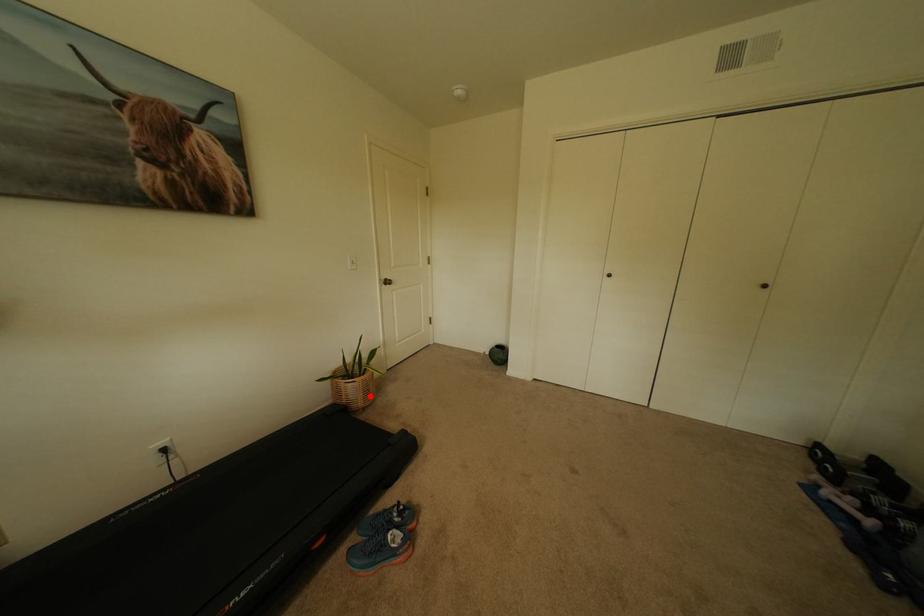
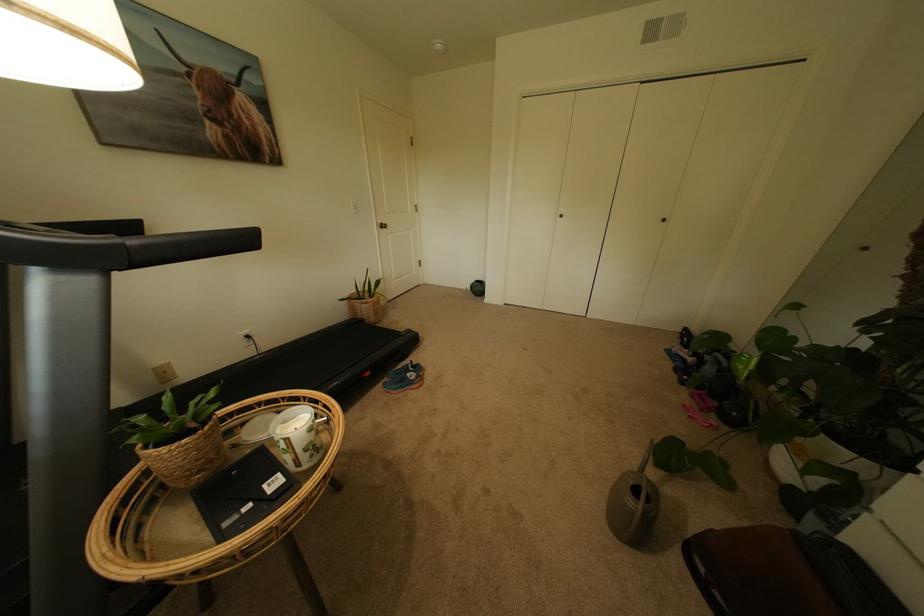
Find the pixel in the second image that matches the highlighted location in the first image.

(382, 314)